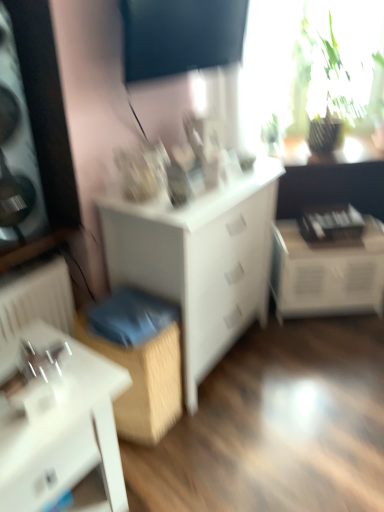
Image resolution: width=384 pixels, height=512 pixels. Identify the location of empty space that is ontop of wooden box at lower center. (126, 312).